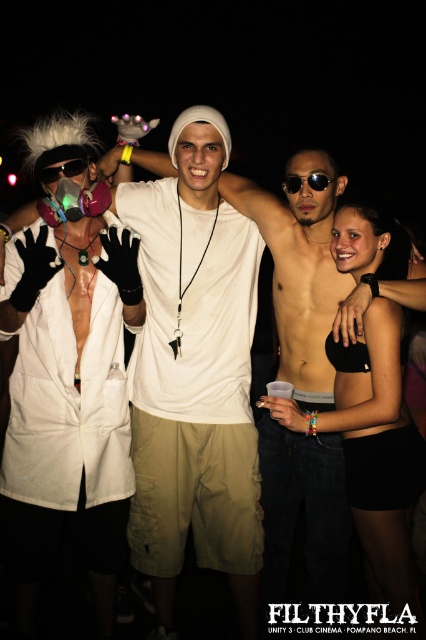
Question: Which object is farther from the camera taking this photo?

Choices:
 (A) sunglasses at center
 (B) matte pink respirator at upper left

Answer: (A)

Question: Does white cotton shirt at center appear on the right side of black matte bikini bottom at center?

Choices:
 (A) yes
 (B) no

Answer: (B)

Question: Which of the following is the farthest from the observer?

Choices:
 (A) white lab coat at center
 (B) black fabric bra at upper right

Answer: (B)

Question: Is white lab coat at center further to the viewer compared to black fabric bra at upper right?

Choices:
 (A) no
 (B) yes

Answer: (A)

Question: Observing the image, what is the correct spatial positioning of black fabric bra at upper right in reference to sunglasses at center?

Choices:
 (A) above
 (B) below

Answer: (B)

Question: Which object appears closest to the camera in this image?

Choices:
 (A) matte pink respirator at upper left
 (B) white lab coat at center

Answer: (B)